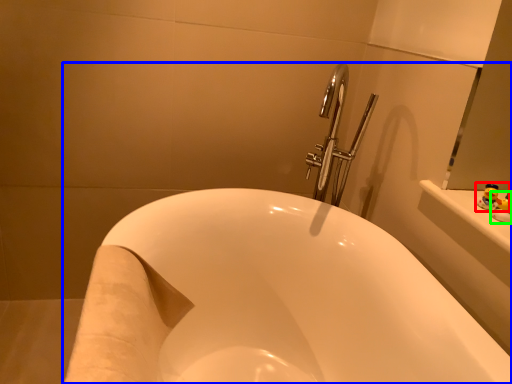
Question: Estimate the real-world distances between objects in this image. Which object is closer to toy (highlighted by a red box), bathtub (highlighted by a blue box) or toy (highlighted by a green box)?

Choices:
 (A) bathtub
 (B) toy

Answer: (B)